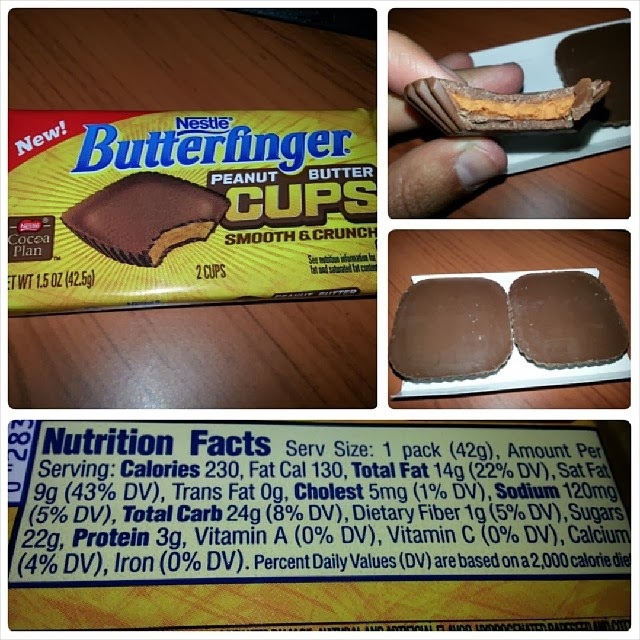
This screenshot has width=640, height=640. Identify the location of table. (235, 358), (470, 246), (566, 198).